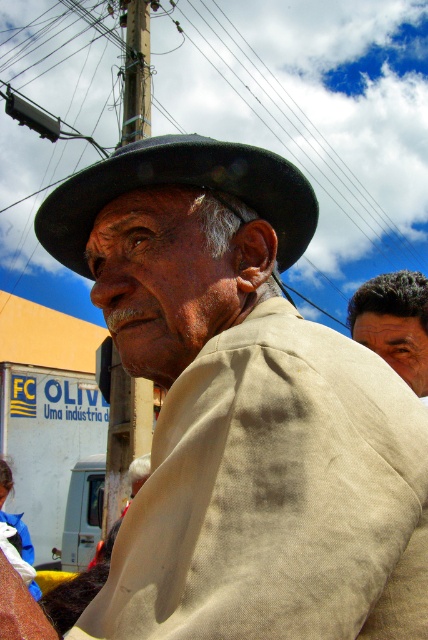
Does matte beige jacket at center have a greater height compared to black felt fedora at center?

Indeed, matte beige jacket at center has a greater height compared to black felt fedora at center.

Between matte beige jacket at center and black felt fedora at center, which one is positioned higher?

black felt fedora at center

Between point (184, 376) and point (184, 138), which one is positioned behind?

Point (184, 138)

This screenshot has width=428, height=640. Find the location of `matte beige jacket at center`. matte beige jacket at center is located at coordinates [243, 410].

Can you confirm if matte beige jacket at center is positioned above brown wooden pole at upper center?

No, matte beige jacket at center is not above brown wooden pole at upper center.

Is matte beige jacket at center bigger than brown wooden pole at upper center?

Actually, matte beige jacket at center might be smaller than brown wooden pole at upper center.

This screenshot has width=428, height=640. Find the location of `matte beige jacket at center`. matte beige jacket at center is located at coordinates point(243,410).

Is point (332, 106) farther from camera compared to point (157, 144)?

That is True.

In the scene shown: Can you confirm if black wire at upper center is thinner than black felt fedora at center?

No.

The width and height of the screenshot is (428, 640). What are the coordinates of `black wire at upper center` in the screenshot? It's located at (374, 99).

Locate an element on the screen. The width and height of the screenshot is (428, 640). black wire at upper center is located at coordinates (374, 99).